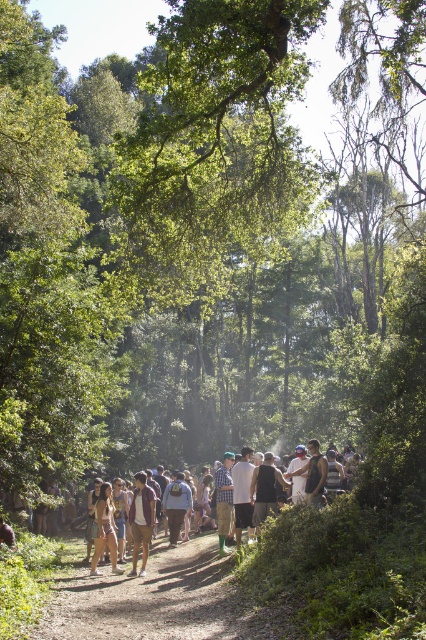
Question: Among these points, which one is nearest to the camera?

Choices:
 (A) (337, 476)
 (B) (221, 550)
 (C) (253, 484)

Answer: (C)

Question: Among these objects, which one is nearest to the camera?

Choices:
 (A) dark gray shirt at center
 (B) white cotton shirt at center
 (C) checkered fabric shirt at center
 (D) green rubber boots at center

Answer: (D)

Question: Is matte gold bikini at center below white cotton shirt at center?

Choices:
 (A) no
 (B) yes

Answer: (B)

Question: Does white cotton shirt at center have a lesser width compared to checkered fabric shirt at center?

Choices:
 (A) no
 (B) yes

Answer: (B)

Question: Observing the image, what is the correct spatial positioning of green rubber boots at center in reference to purple fabric shirt at center?

Choices:
 (A) right
 (B) left

Answer: (A)

Question: Which point is farther to the camera?

Choices:
 (A) checkered fabric shirt at center
 (B) white cotton shirt at center
 (C) green rubber boots at center
 (D) dark gray shirt at center

Answer: (A)